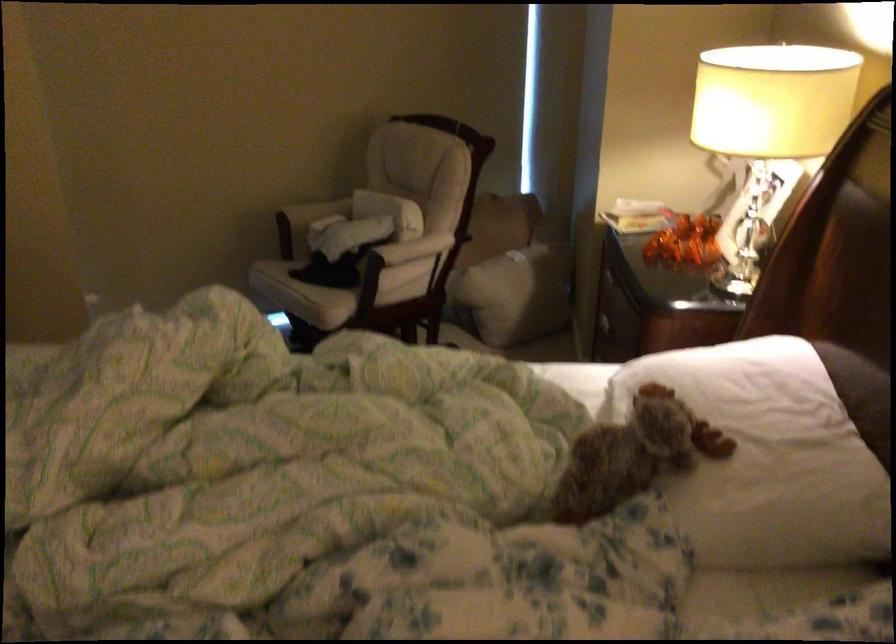
Which object does [633,453] point to?

It corresponds to the brown stuffed moose in the image.